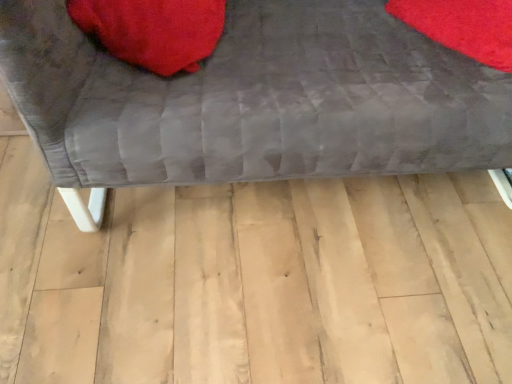
What is the approximate height of velvet gray couch at center?

It is 25.03 inches.

This screenshot has width=512, height=384. What do you see at coordinates (253, 101) in the screenshot?
I see `velvet gray couch at center` at bounding box center [253, 101].

Find the location of a particular element. This screenshot has height=384, width=512. velvet gray couch at center is located at coordinates (253, 101).

This screenshot has height=384, width=512. Find the location of `velvet red bean bag at upper left`. velvet red bean bag at upper left is located at coordinates (153, 30).

The image size is (512, 384). What do you see at coordinates (153, 30) in the screenshot? I see `velvet red bean bag at upper left` at bounding box center [153, 30].

Measure the distance between point (152, 20) and camera.

The distance of point (152, 20) from camera is 36.10 inches.

The width and height of the screenshot is (512, 384). Find the location of `velvet gray couch at center`. velvet gray couch at center is located at coordinates (253, 101).

Is velvet gray couch at center to the left or to the right of velvet red bean bag at upper left in the image?

Clearly, velvet gray couch at center is on the right of velvet red bean bag at upper left in the image.

Which object is further away from the camera taking this photo, velvet gray couch at center or velvet red bean bag at upper left?

velvet red bean bag at upper left is more distant.

Considering the positions of points (15, 98) and (80, 20), is point (15, 98) farther from camera compared to point (80, 20)?

That is False.

From the image's perspective, which is below, velvet gray couch at center or velvet red bean bag at upper left?

velvet gray couch at center.

In the scene shown: From a real-world perspective, between velvet gray couch at center and velvet red bean bag at upper left, who is vertically higher?

velvet red bean bag at upper left.

Which object is wider, velvet gray couch at center or velvet red bean bag at upper left?

Wider between the two is velvet gray couch at center.

Who is taller, velvet gray couch at center or velvet red bean bag at upper left?

velvet gray couch at center.

From the picture: Considering the relative sizes of velvet gray couch at center and velvet red bean bag at upper left in the image provided, is velvet gray couch at center bigger than velvet red bean bag at upper left?

Yes.

Does velvet gray couch at center contain velvet red bean bag at upper left?

Yes, velvet red bean bag at upper left is a part of velvet gray couch at center.

Is velvet gray couch at center beside velvet red bean bag at upper left?

They are not placed beside each other.

Does velvet gray couch at center turn towards velvet red bean bag at upper left?

Yes.

Can you tell me how much velvet gray couch at center and velvet red bean bag at upper left differ in facing direction?

The facing directions of velvet gray couch at center and velvet red bean bag at upper left are 7.81e-05 degrees apart.

Locate an element on the screen. The width and height of the screenshot is (512, 384). furniture below the velvet red bean bag at upper left (from the image's perspective) is located at coordinates (253, 101).

Which object is positioned more to the right, velvet red bean bag at upper left or velvet gray couch at center?

velvet gray couch at center is more to the right.

Is the position of velvet red bean bag at upper left more distant than that of velvet gray couch at center?

That is True.

Which is closer to the camera, (183, 48) or (482, 95)?

Point (183, 48) appears to be farther away from the viewer than point (482, 95).

From the image's perspective, is velvet red bean bag at upper left over velvet gray couch at center?

Indeed, from the image's perspective, velvet red bean bag at upper left is shown above velvet gray couch at center.

From a real-world perspective, does velvet red bean bag at upper left stand above velvet gray couch at center?

Correct, in the physical world, velvet red bean bag at upper left is higher than velvet gray couch at center.

Is velvet red bean bag at upper left thinner than velvet gray couch at center?

Yes, velvet red bean bag at upper left is thinner than velvet gray couch at center.

Based on the photo, considering the sizes of objects velvet red bean bag at upper left and velvet gray couch at center in the image provided, who is shorter, velvet red bean bag at upper left or velvet gray couch at center?

velvet red bean bag at upper left.

Which of these two, velvet red bean bag at upper left or velvet gray couch at center, is smaller?

With smaller size is velvet red bean bag at upper left.

Is velvet gray couch at center inside velvet red bean bag at upper left?

Definitely not — velvet gray couch at center is not inside velvet red bean bag at upper left.

Is velvet red bean bag at upper left not near velvet gray couch at center?

They are positioned close to each other.

Is velvet red bean bag at upper left looking in the opposite direction of velvet gray couch at center?

Yes, velvet red bean bag at upper left is facing away from velvet gray couch at center.

How distant is velvet red bean bag at upper left from velvet gray couch at center?

velvet red bean bag at upper left and velvet gray couch at center are 9.24 inches apart from each other.

The height and width of the screenshot is (384, 512). There is a velvet gray couch at center. What are the coordinates of `bean bag chair above it (from a real-world perspective)` in the screenshot? It's located at (153, 30).

You are a GUI agent. You are given a task and a screenshot of the screen. Output one action in this format:
    pyautogui.click(x=<x>, y=<y>)
    Task: Click on the bean bag chair lying above the velvet gray couch at center (from the image's perspective)
    The image size is (512, 384).
    Given the screenshot: What is the action you would take?
    pyautogui.click(x=153, y=30)

I want to click on bean bag chair on the left of velvet gray couch at center, so click(153, 30).